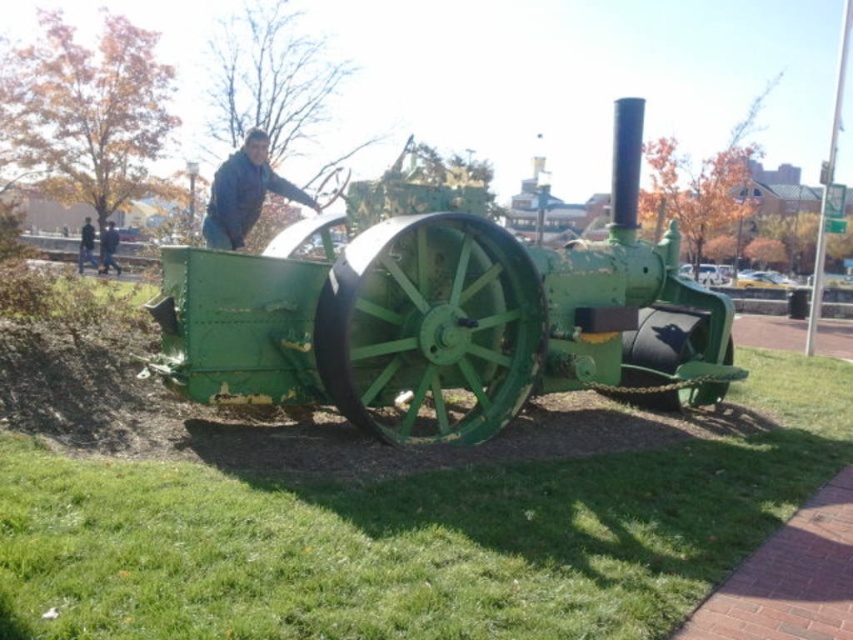
Can you confirm if green matte tractor at center is positioned to the left of dark blue jeans at center?

Incorrect, green matte tractor at center is not on the left side of dark blue jeans at center.

Between green matte tractor at center and dark blue jeans at center, which one appears on the left side from the viewer's perspective?

dark blue jeans at center

Where is `green matte tractor at center`? green matte tractor at center is located at coordinates (444, 320).

Which is behind, point (103, 248) or point (77, 257)?

The point (77, 257) is more distant.

Does point (109, 248) lie in front of point (85, 253)?

Yes, it is in front of point (85, 253).

Which is behind, point (100, 234) or point (86, 257)?

Point (100, 234)

Locate an element on the screen. blue denim jacket at upper center is located at coordinates (108, 248).

Which is below, green grass at lower left or blue denim jacket at upper center?

green grass at lower left

Is point (218, 524) positioned after point (107, 260)?

No, (218, 524) is in front of (107, 260).

This screenshot has width=853, height=640. In order to click on green grass at lower left in this screenshot , I will do `click(410, 536)`.